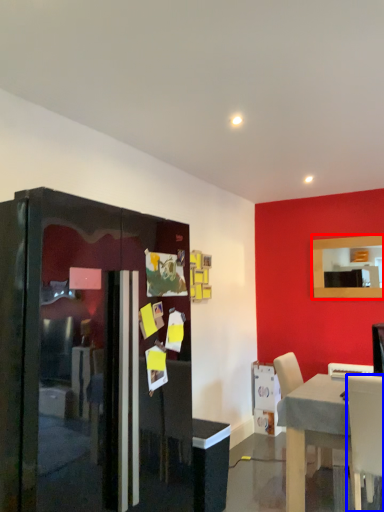
Question: Which object appears closest to the camera in this image, mirror (highlighted by a red box) or chair (highlighted by a blue box)?

Choices:
 (A) mirror
 (B) chair

Answer: (B)